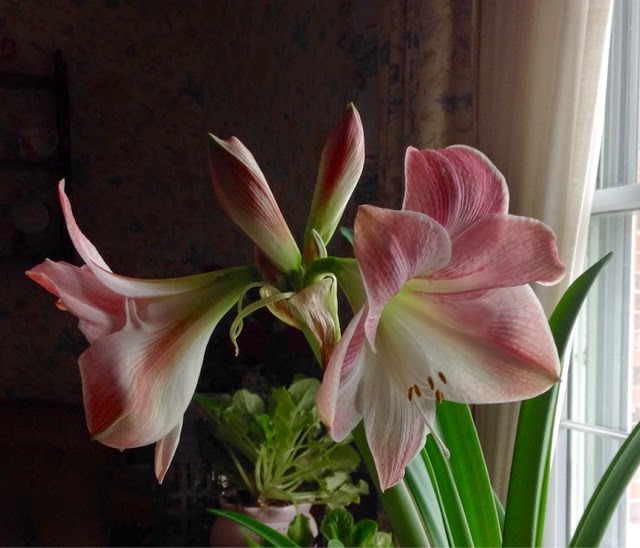
Where is `curtain`? The image size is (640, 548). curtain is located at coordinates (538, 90).